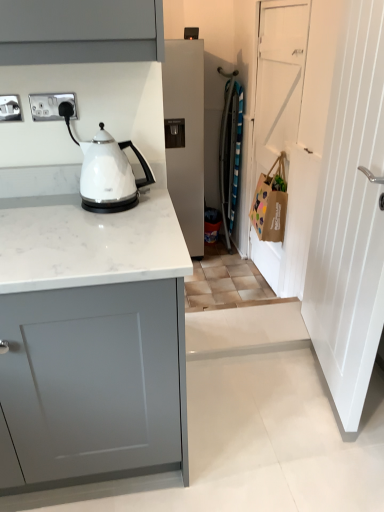
Question: Is white matte door at right, the 2th door from the front, oriented away from white wooden door at right, placed as the 2th door when sorted from back to front?

Choices:
 (A) no
 (B) yes

Answer: (A)

Question: Considering the relative sizes of white matte door at right, the 2th door from the front, and white wooden door at right, placed as the 2th door when sorted from back to front, in the image provided, is white matte door at right, the 2th door from the front, shorter than white wooden door at right, placed as the 2th door when sorted from back to front,?

Choices:
 (A) no
 (B) yes

Answer: (A)

Question: From a real-world perspective, is white matte door at right, the 2th door from the front, under white wooden door at right, placed as the 2th door when sorted from back to front?

Choices:
 (A) no
 (B) yes

Answer: (B)

Question: From a real-world perspective, is white matte door at right, the 2th door from the front, on top of white wooden door at right, the first door when ordered from front to back?

Choices:
 (A) yes
 (B) no

Answer: (B)

Question: Can you confirm if white matte door at right, which ranks as the first door in back-to-front order, is positioned to the left of white wooden door at right, placed as the 2th door when sorted from back to front?

Choices:
 (A) no
 (B) yes

Answer: (A)

Question: Considering the positions of point (13, 116) and point (142, 231), is point (13, 116) closer or farther from the camera than point (142, 231)?

Choices:
 (A) farther
 (B) closer

Answer: (A)

Question: From a real-world perspective, relative to white marble countertop at center, is satin silver socket at upper left, which appears as the second electric outlet when viewed from the right, vertically above or below?

Choices:
 (A) below
 (B) above

Answer: (B)

Question: From the image's perspective, is satin silver socket at upper left, which appears as the second electric outlet when viewed from the right, above or below white marble countertop at center?

Choices:
 (A) above
 (B) below

Answer: (A)

Question: Considering the positions of satin silver socket at upper left, marked as the 1th electric outlet in a left-to-right arrangement, and white marble countertop at center in the image, is satin silver socket at upper left, marked as the 1th electric outlet in a left-to-right arrangement, wider or thinner than white marble countertop at center?

Choices:
 (A) wide
 (B) thin

Answer: (B)

Question: From a real-world perspective, is white marble countertop at center positioned above or below brown paper bag at right?

Choices:
 (A) above
 (B) below

Answer: (A)

Question: From the image's perspective, is white marble countertop at center located above or below brown paper bag at right?

Choices:
 (A) below
 (B) above

Answer: (A)

Question: Is point (168, 330) closer or farther from the camera than point (273, 212)?

Choices:
 (A) farther
 (B) closer

Answer: (B)

Question: In terms of height, does white marble countertop at center look taller or shorter compared to brown paper bag at right?

Choices:
 (A) tall
 (B) short

Answer: (A)

Question: Based on their positions, is white wooden door at right, placed as the 2th door when sorted from back to front, located to the left or right of brown paper bag at right?

Choices:
 (A) right
 (B) left

Answer: (A)

Question: Is white wooden door at right, the first door when ordered from front to back, inside or outside of brown paper bag at right?

Choices:
 (A) outside
 (B) inside

Answer: (A)